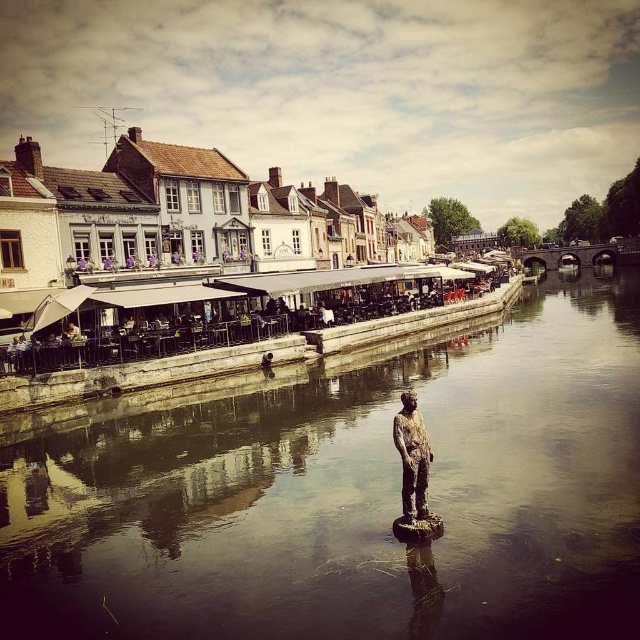
Is point (304, 468) closer to camera compared to point (410, 422)?

No, it is not.

In the scene shown: Is smooth reflective water at center to the left of bronze statue at center from the viewer's perspective?

Incorrect, smooth reflective water at center is not on the left side of bronze statue at center.

Who is more distant from viewer, (260, 611) or (401, 420)?

Point (401, 420)

Identify the location of smooth reflective water at center. The image size is (640, 640). (353, 497).